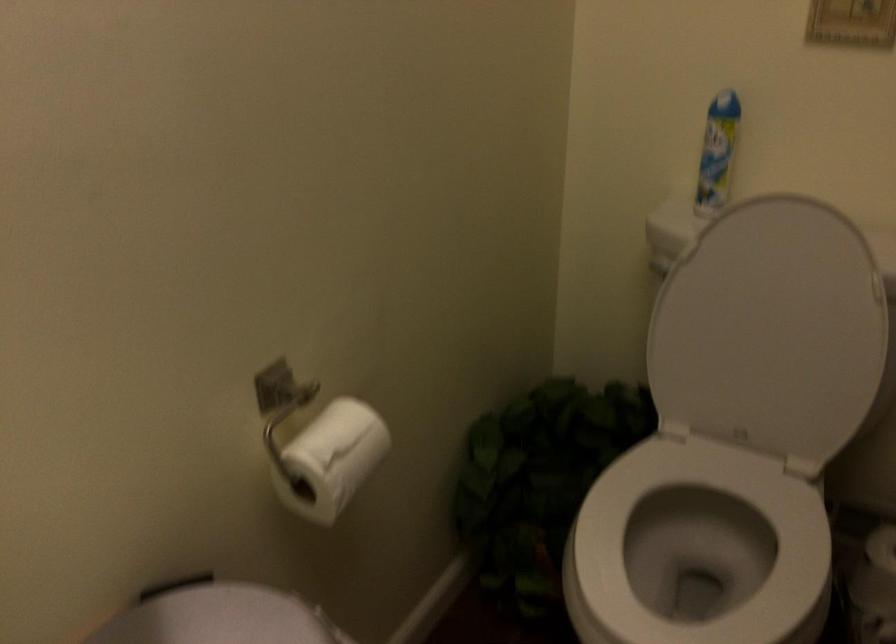
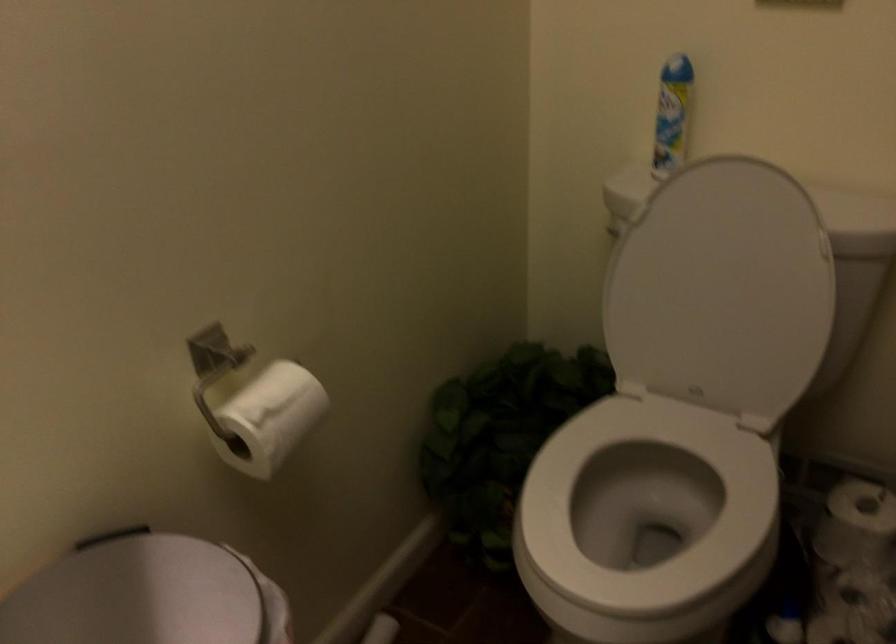
Find the pixel in the second image that matches point 685,559 in the first image.

(645, 516)